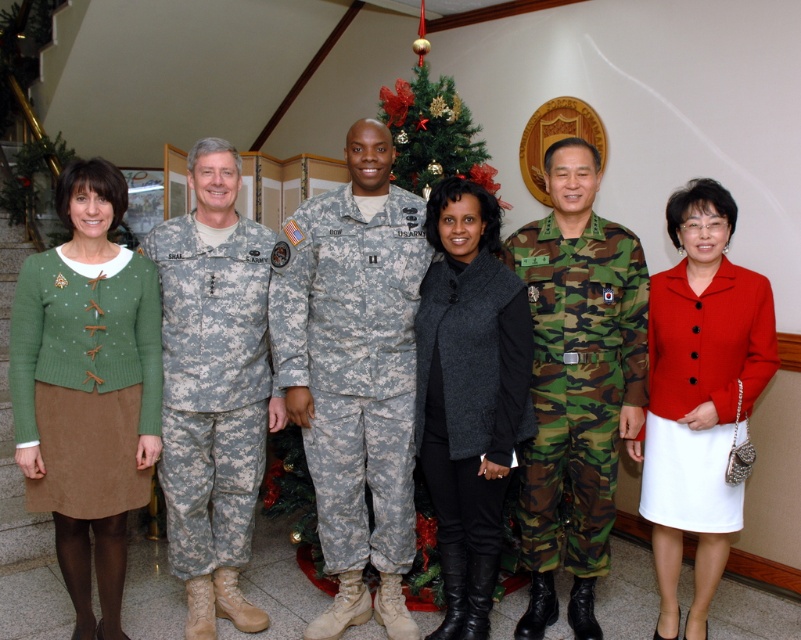
Which is above, charcoal woolen vest at center or camouflage fabric uniform at center?

camouflage fabric uniform at center

Between charcoal woolen vest at center and camouflage fabric uniform at center, which one appears on the left side from the viewer's perspective?

camouflage fabric uniform at center

Image resolution: width=801 pixels, height=640 pixels. I want to click on charcoal woolen vest at center, so click(469, 394).

The width and height of the screenshot is (801, 640). Describe the element at coordinates (699, 394) in the screenshot. I see `matte red blazer at center` at that location.

Is point (679, 512) farther from viewer compared to point (180, 435)?

No, (679, 512) is in front of (180, 435).

Where is `matte red blazer at center`? This screenshot has width=801, height=640. matte red blazer at center is located at coordinates (699, 394).

Which is behind, point (634, 336) or point (691, 488)?

Point (634, 336)

Which of these two, camo uniform at center or matte red blazer at center, stands shorter?

matte red blazer at center is shorter.

What do you see at coordinates (576, 380) in the screenshot? I see `camo uniform at center` at bounding box center [576, 380].

At what (x,y) coordinates should I click in order to perform the action: click on camo uniform at center. Please return your answer as a coordinate pair (x, y). The height and width of the screenshot is (640, 801). Looking at the image, I should click on (576, 380).